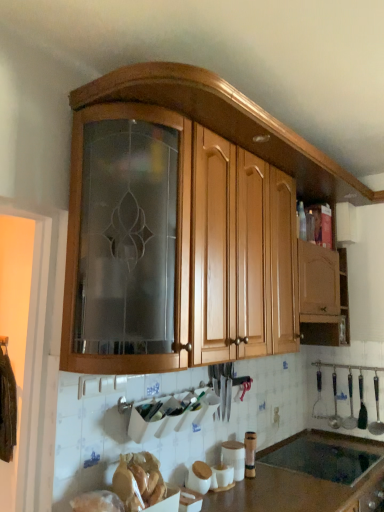
Where is `vacant point to the right of white glossy canister at lower center, the second appliance when ordered from front to back`? The height and width of the screenshot is (512, 384). vacant point to the right of white glossy canister at lower center, the second appliance when ordered from front to back is located at coordinates click(x=266, y=485).